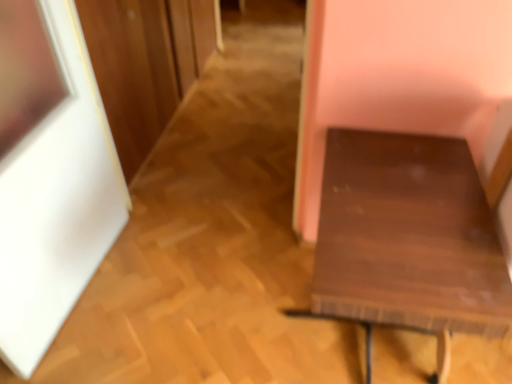
Question: Does dark wood table at right turn towards white matte picture frame at left?

Choices:
 (A) yes
 (B) no

Answer: (B)

Question: From a real-world perspective, is dark wood table at right on white matte picture frame at left?

Choices:
 (A) yes
 (B) no

Answer: (B)

Question: Is dark wood table at right in front of white matte picture frame at left?

Choices:
 (A) yes
 (B) no

Answer: (B)

Question: Is dark wood table at right not within white matte picture frame at left?

Choices:
 (A) yes
 (B) no

Answer: (A)

Question: Does dark wood table at right touch white matte picture frame at left?

Choices:
 (A) no
 (B) yes

Answer: (A)

Question: From a real-world perspective, is dark wood table at right beneath white matte picture frame at left?

Choices:
 (A) yes
 (B) no

Answer: (A)

Question: Is white matte picture frame at left looking in the opposite direction of dark wood table at right?

Choices:
 (A) yes
 (B) no

Answer: (B)

Question: Is there a large distance between white matte picture frame at left and dark wood table at right?

Choices:
 (A) no
 (B) yes

Answer: (B)

Question: Considering the relative positions of white matte picture frame at left and dark wood table at right in the image provided, is white matte picture frame at left to the left of dark wood table at right from the viewer's perspective?

Choices:
 (A) no
 (B) yes

Answer: (B)

Question: Does white matte picture frame at left have a larger size compared to dark wood table at right?

Choices:
 (A) yes
 (B) no

Answer: (B)

Question: Is white matte picture frame at left surrounding dark wood table at right?

Choices:
 (A) yes
 (B) no

Answer: (B)

Question: Considering the relative sizes of white matte picture frame at left and dark wood table at right in the image provided, is white matte picture frame at left thinner than dark wood table at right?

Choices:
 (A) no
 (B) yes

Answer: (B)

Question: From their relative heights in the image, would you say dark wood table at right is taller or shorter than white matte picture frame at left?

Choices:
 (A) tall
 (B) short

Answer: (B)